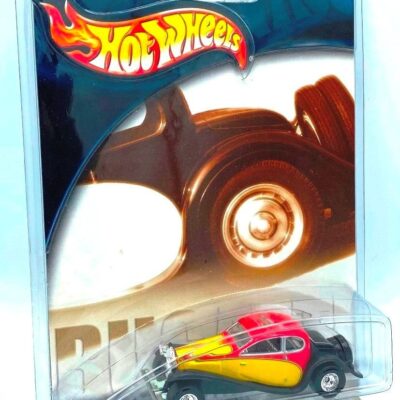
Locate an element on the screen. red paint is located at coordinates (259, 322), (300, 355), (228, 340).